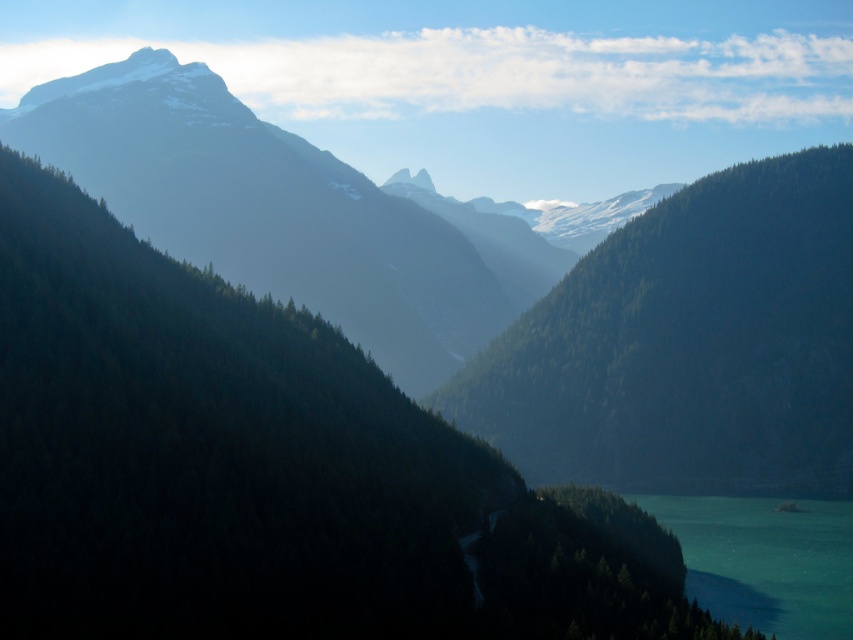
Can you confirm if green forested mountain range at center is wider than teal glossy water at lower right?

Yes.

Can you confirm if green forested mountain range at center is positioned to the left of teal glossy water at lower right?

Indeed, green forested mountain range at center is positioned on the left side of teal glossy water at lower right.

I want to click on green forested mountain range at center, so click(x=509, y=284).

The image size is (853, 640). Find the location of `green forested mountain range at center`. green forested mountain range at center is located at coordinates click(509, 284).

Does green textured forest at center have a smaller size compared to teal glossy water at lower right?

Actually, green textured forest at center might be larger than teal glossy water at lower right.

Is green textured forest at center in front of teal glossy water at lower right?

No, green textured forest at center is behind teal glossy water at lower right.

Is point (489, 433) more distant than point (692, 550)?

Yes, point (489, 433) is farther from viewer.

Locate an element on the screen. The height and width of the screenshot is (640, 853). green textured forest at center is located at coordinates (688, 346).

Which is above, green forested mountain range at center or green textured forest at center?

green forested mountain range at center is higher up.

Between green forested mountain range at center and green textured forest at center, which one appears on the right side from the viewer's perspective?

From the viewer's perspective, green textured forest at center appears more on the right side.

The image size is (853, 640). Describe the element at coordinates (509, 284) in the screenshot. I see `green forested mountain range at center` at that location.

The image size is (853, 640). In order to click on green forested mountain range at center in this screenshot , I will do `click(509, 284)`.